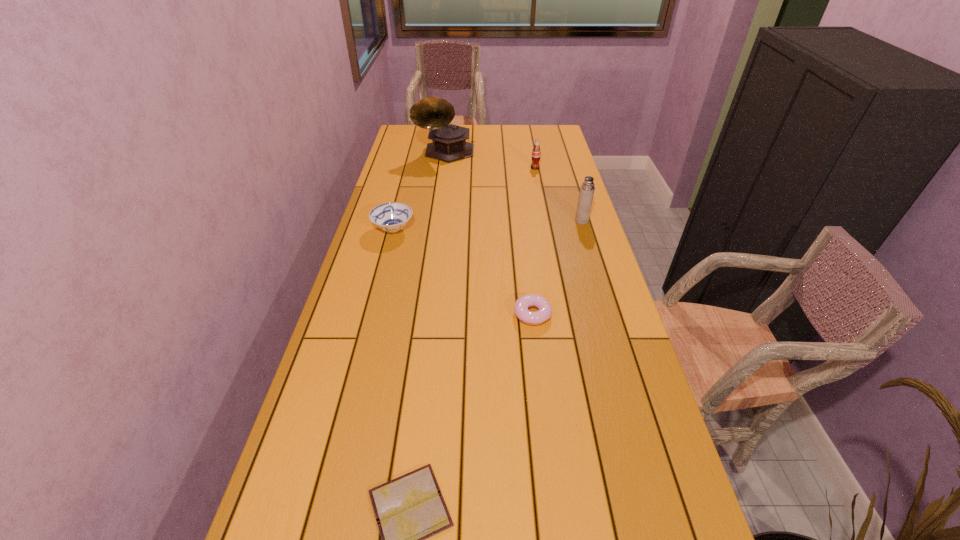
At what (x,y) coordinates should I click in order to perform the action: click on phonograph record. Please return your answer as a coordinate pair (x, y). This screenshot has width=960, height=540. Looking at the image, I should click on (449, 144).

Identify the location of thermos bottle. The width and height of the screenshot is (960, 540). (587, 189).

You are a GUI agent. You are given a task and a screenshot of the screen. Output one action in this format:
    pyautogui.click(x=<x>, y=<y>)
    Task: Click on the rightmost object
    This screenshot has height=540, width=960.
    Given the screenshot: What is the action you would take?
    587,189

Identify the location of the second object from right to left. (536, 153).

The width and height of the screenshot is (960, 540). What are the coordinates of `the third tallest object` in the screenshot? It's located at (536, 153).

Where is `the fourth tallest object`? This screenshot has height=540, width=960. the fourth tallest object is located at coordinates (391, 217).

At what (x,y) coordinates should I click in order to perform the action: click on the fifth tallest object. Please return your answer as a coordinate pair (x, y). This screenshot has height=540, width=960. Looking at the image, I should click on (544, 312).

Locate an element on the screen. the third object from right to left is located at coordinates (544, 312).

Identify the location of free space located on the horn direction of the phonograph record. (443, 177).

Find the location of `blank space located on the left of the fifth shortest object`. blank space located on the left of the fifth shortest object is located at coordinates (477, 221).